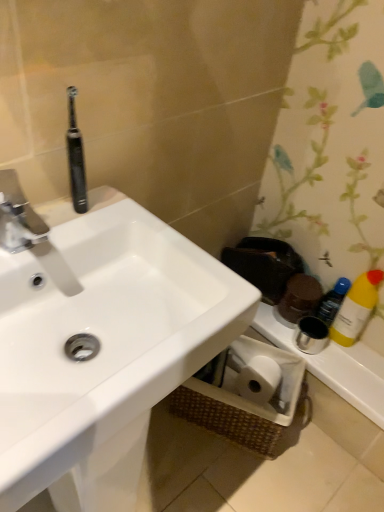
Question: Looking at their shapes, would you say silver metallic faucet at upper left is wider or thinner than yellow plastic bottle at right?

Choices:
 (A) wide
 (B) thin

Answer: (A)

Question: In the image, is silver metallic faucet at upper left on the left side or the right side of yellow plastic bottle at right?

Choices:
 (A) left
 (B) right

Answer: (A)

Question: Which of these objects is positioned closest to the blue plastic bottle at lower right?

Choices:
 (A) white plastic toilet paper holder at lower right
 (B) white glossy sink at upper left
 (C) silver metallic faucet at upper left
 (D) yellow plastic bottle at right
 (E) black rubber toothbrush at upper left

Answer: (D)

Question: Estimate the real-world distances between objects in this image. Which object is closer to the blue plastic bottle at lower right?

Choices:
 (A) black rubber toothbrush at upper left
 (B) yellow plastic bottle at right
 (C) silver metallic faucet at upper left
 (D) white glossy sink at upper left
 (E) white plastic toilet paper holder at lower right

Answer: (B)